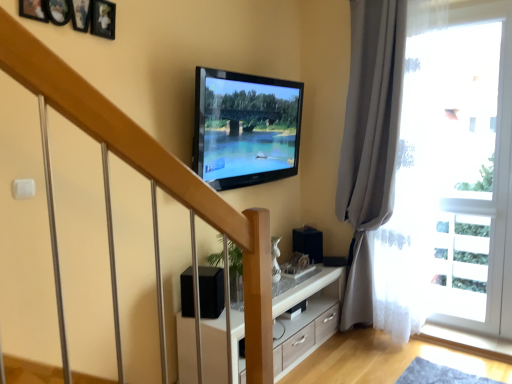
Image resolution: width=512 pixels, height=384 pixels. What do you see at coordinates (451, 176) in the screenshot?
I see `transparent glass door at right` at bounding box center [451, 176].

Locate an element on the screen. This screenshot has width=512, height=384. gray fabric curtain at right is located at coordinates (370, 141).

The image size is (512, 384). Describe the element at coordinates (245, 128) in the screenshot. I see `flat screen tv at upper center` at that location.

The width and height of the screenshot is (512, 384). What do you see at coordinates (211, 291) in the screenshot?
I see `black matte speaker at lower center` at bounding box center [211, 291].

Image resolution: width=512 pixels, height=384 pixels. Find the location of `transparent glass door at right`. transparent glass door at right is located at coordinates (451, 176).

Is transparent glass door at right oriented towards flat screen tv at upper center?

No, transparent glass door at right does not turn towards flat screen tv at upper center.

Is transparent glass door at right next to flat screen tv at upper center?

They are not placed beside each other.

Considering the relative sizes of transparent glass door at right and flat screen tv at upper center in the image provided, is transparent glass door at right taller than flat screen tv at upper center?

Indeed, transparent glass door at right has a greater height compared to flat screen tv at upper center.

Considering the relative sizes of transparent glass door at right and flat screen tv at upper center in the image provided, is transparent glass door at right bigger than flat screen tv at upper center?

Actually, transparent glass door at right might be smaller than flat screen tv at upper center.

Do you think transparent glass door at right is within gray fabric curtain at right, or outside of it?

transparent glass door at right is located beyond the bounds of gray fabric curtain at right.

From a real-world perspective, who is located higher, transparent glass door at right or gray fabric curtain at right?

From a 3D spatial view, gray fabric curtain at right is above.

Consider the image. Is transparent glass door at right closer to camera compared to gray fabric curtain at right?

No, the depth of transparent glass door at right is greater than that of gray fabric curtain at right.

Based on the photo, from the image's perspective, which is above, transparent glass door at right or gray fabric curtain at right?

gray fabric curtain at right.

Does white wood cabinet at center turn towards black matte speaker at lower center?

No, white wood cabinet at center is not aimed at black matte speaker at lower center.

Which object is thinner, white wood cabinet at center or black matte speaker at lower center?

black matte speaker at lower center is thinner.

From the picture: Which is closer to the camera, (210, 333) or (207, 270)?

Clearly, point (210, 333) is closer to the camera than point (207, 270).

Between white wood cabinet at center and black matte speaker at lower center, which one appears on the right side from the viewer's perspective?

Positioned to the right is white wood cabinet at center.

This screenshot has width=512, height=384. In order to click on television on the left side of white wood cabinet at center in this screenshot , I will do `click(245, 128)`.

Is flat screen tv at upper center inside white wood cabinet at center?

No, white wood cabinet at center does not contain flat screen tv at upper center.

From a real-world perspective, is white wood cabinet at center physically located above or below flat screen tv at upper center?

In terms of real-world spatial position, white wood cabinet at center is below flat screen tv at upper center.

Does white wood cabinet at center touch flat screen tv at upper center?

white wood cabinet at center is not next to flat screen tv at upper center, and they're not touching.

From a real-world perspective, is gray fabric curtain at right physically located above or below white wood cabinet at center?

From a real-world perspective, gray fabric curtain at right is physically above white wood cabinet at center.

Is gray fabric curtain at right thinner than white wood cabinet at center?

Yes.

Between gray fabric curtain at right and white wood cabinet at center, which one is positioned in front?

white wood cabinet at center.

Considering the positions of points (371, 92) and (327, 299), is point (371, 92) closer to camera compared to point (327, 299)?

That is True.

Is flat screen tv at upper center surrounded by black matte speaker at lower center?

No, black matte speaker at lower center does not contain flat screen tv at upper center.

How different are the orientations of black matte speaker at lower center and flat screen tv at upper center in degrees?

black matte speaker at lower center and flat screen tv at upper center are facing 28.9 degrees away from each other.

From a real-world perspective, is black matte speaker at lower center physically located above or below flat screen tv at upper center?

From a real-world perspective, black matte speaker at lower center is physically below flat screen tv at upper center.

Who is shorter, black matte speaker at lower center or flat screen tv at upper center?

With less height is black matte speaker at lower center.

This screenshot has height=384, width=512. Find the location of `window that appears behind the flat screen tv at upper center`. window that appears behind the flat screen tv at upper center is located at coordinates (451, 176).

Based on the photo, which is further, [207,86] or [451,161]?

The point [451,161] is behind.

Is flat screen tv at upper center taller or shorter than transparent glass door at right?

Considering their sizes, flat screen tv at upper center has less height than transparent glass door at right.

Between flat screen tv at upper center and transparent glass door at right, which one has smaller width?

transparent glass door at right.

I want to click on window lying on the right of flat screen tv at upper center, so click(451, 176).

Locate an element on the screen. The height and width of the screenshot is (384, 512). window lying below the gray fabric curtain at right (from the image's perspective) is located at coordinates (451, 176).

From the image, which object appears to be farther from transparent glass door at right, flat screen tv at upper center or gray fabric curtain at right?

Among the two, flat screen tv at upper center is located further to transparent glass door at right.

Which object lies nearer to the anchor point gray fabric curtain at right, flat screen tv at upper center or white wood cabinet at center?

flat screen tv at upper center lies closer to gray fabric curtain at right than the other object.

Which object lies further to the anchor point black matte speaker at lower center, white wood cabinet at center or gray fabric curtain at right?

Based on the image, gray fabric curtain at right appears to be further to black matte speaker at lower center.

When comparing their distances from transparent glass door at right, does white wood cabinet at center or gray fabric curtain at right seem further?

white wood cabinet at center lies further to transparent glass door at right than the other object.

Which object lies nearer to the anchor point black matte speaker at lower center, flat screen tv at upper center or transparent glass door at right?

flat screen tv at upper center is positioned closer to the anchor black matte speaker at lower center.

Which object lies further to the anchor point black matte speaker at lower center, transparent glass door at right or flat screen tv at upper center?

The object further to black matte speaker at lower center is transparent glass door at right.

Considering their positions, is white wood cabinet at center positioned closer to black matte speaker at lower center than flat screen tv at upper center?

white wood cabinet at center is closer to black matte speaker at lower center.

Looking at the image, which one is located further to gray fabric curtain at right, black matte speaker at lower center or transparent glass door at right?

black matte speaker at lower center is positioned further to the anchor gray fabric curtain at right.

At what (x,y) coordinates should I click in order to perform the action: click on curtain located between flat screen tv at upper center and transparent glass door at right in the left-right direction. Please return your answer as a coordinate pair (x, y). The image size is (512, 384). Looking at the image, I should click on (370, 141).

Where is `speaker between flat screen tv at upper center and white wood cabinet at center in the vertical direction`? The width and height of the screenshot is (512, 384). speaker between flat screen tv at upper center and white wood cabinet at center in the vertical direction is located at coordinates (211, 291).

This screenshot has height=384, width=512. In order to click on curtain situated between black matte speaker at lower center and transparent glass door at right from left to right in this screenshot , I will do `click(370, 141)`.

I want to click on cabinetry located between black matte speaker at lower center and transparent glass door at right in the left-right direction, so click(x=310, y=298).